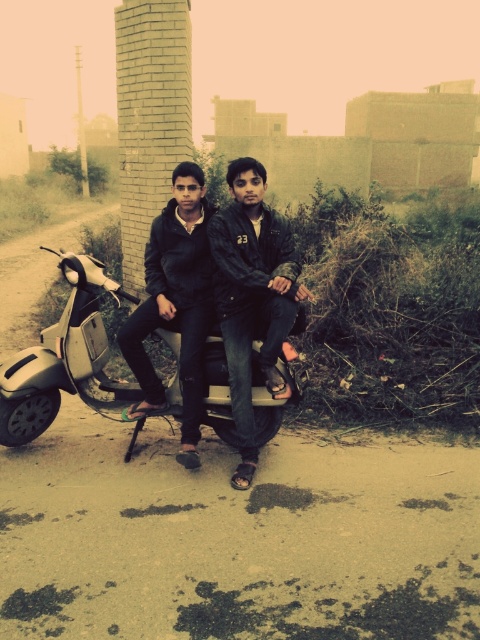
Question: Which point is closer to the camera taking this photo?

Choices:
 (A) (220, 344)
 (B) (224, 316)

Answer: (B)

Question: Which object appears farthest from the camera in this image?

Choices:
 (A) dark blue jeans at center
 (B) metallic silver scooter at center

Answer: (B)

Question: Does dark blue jeans at center appear on the left side of metallic silver scooter at center?

Choices:
 (A) yes
 (B) no

Answer: (B)

Question: Does dark blue jeans at center come behind metallic silver scooter at center?

Choices:
 (A) yes
 (B) no

Answer: (B)

Question: In this image, where is dark blue jeans at center located relative to metallic silver scooter at center?

Choices:
 (A) left
 (B) right

Answer: (B)